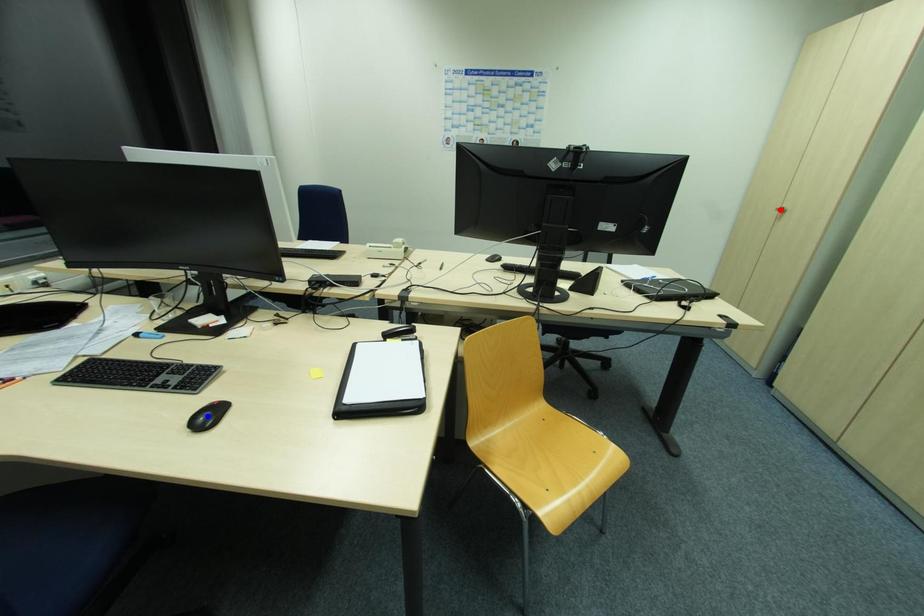
Question: Two points are marked on the image. Which point is closer to the camera?

Choices:
 (A) Blue point is closer.
 (B) Red point is closer.

Answer: (A)